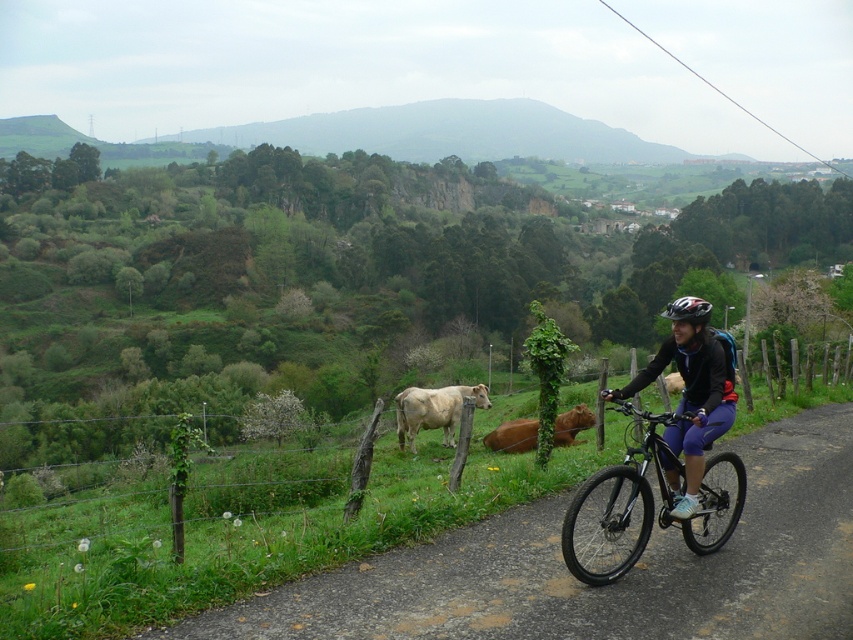
Is matte black bicycle at center to the right of matte black helmet at center from the viewer's perspective?

Incorrect, matte black bicycle at center is not on the right side of matte black helmet at center.

Does matte black bicycle at center have a larger size compared to matte black helmet at center?

No.

Measure the distance between point (729, 401) and camera.

Point (729, 401) and camera are 19.73 feet apart.

Locate an element on the screen. The width and height of the screenshot is (853, 640). matte black bicycle at center is located at coordinates (692, 388).

Does green wooden fence at lower center have a smaller size compared to matte black helmet at center?

Incorrect, green wooden fence at lower center is not smaller in size than matte black helmet at center.

Does green wooden fence at lower center appear over matte black helmet at center?

Incorrect, green wooden fence at lower center is not positioned above matte black helmet at center.

Identify the location of green wooden fence at lower center. (264, 502).

Identify the location of green wooden fence at lower center. (264, 502).

Who is lower down, matte black bicycle at center or brown leather cow at center?

brown leather cow at center is lower down.

Is matte black bicycle at center shorter than brown leather cow at center?

Incorrect, matte black bicycle at center's height does not fall short of brown leather cow at center's.

The width and height of the screenshot is (853, 640). In order to click on matte black bicycle at center in this screenshot , I will do `click(692, 388)`.